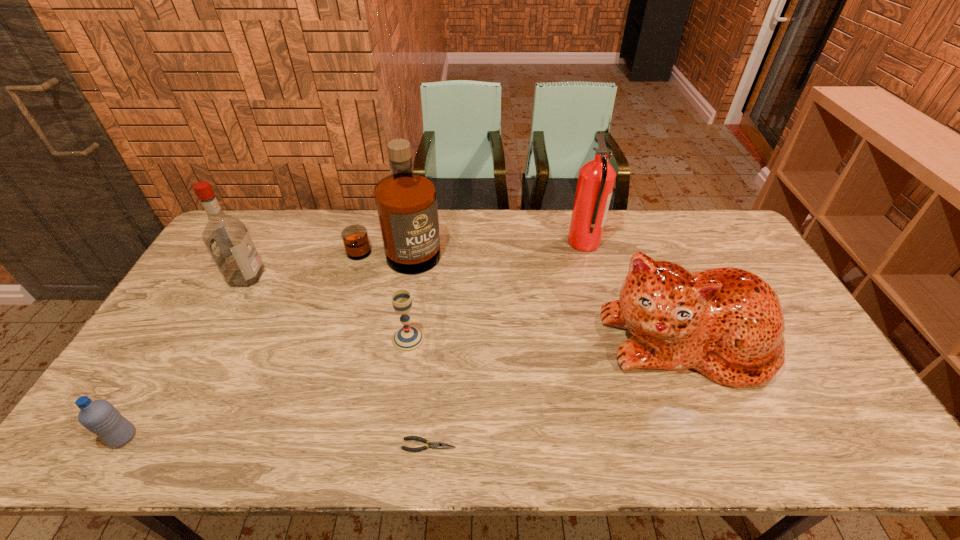
The width and height of the screenshot is (960, 540). I want to click on the taller liquor, so click(406, 202).

The height and width of the screenshot is (540, 960). Identify the location of fire extinguisher. (596, 179).

This screenshot has height=540, width=960. I want to click on the shorter liquor, so click(x=227, y=239).

I want to click on the second object from left to right, so click(227, 239).

Locate an element on the screen. This screenshot has width=960, height=540. cat is located at coordinates tap(727, 323).

The width and height of the screenshot is (960, 540). Find the location of `chalice`. chalice is located at coordinates (408, 338).

This screenshot has height=540, width=960. I want to click on water bottle, so click(x=100, y=417).

Image resolution: width=960 pixels, height=540 pixels. What are the coordinates of `the shortest object` in the screenshot? It's located at point(434,445).

Find the location of a particular element. This screenshot has height=540, width=960. vacant position located on the front label of the taller liquor is located at coordinates (380, 320).

Locate an element on the screen. The width and height of the screenshot is (960, 540). free spot located 0.250m at the nozzle of the fire extinguisher is located at coordinates (497, 242).